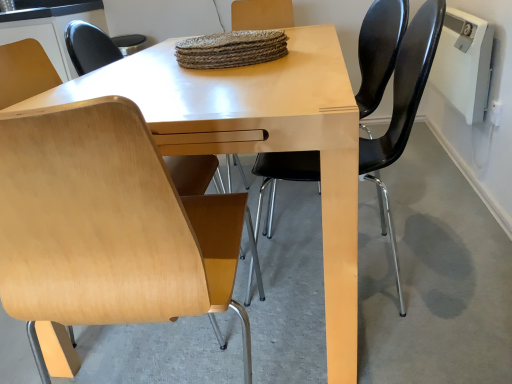
The width and height of the screenshot is (512, 384). What do you see at coordinates (108, 224) in the screenshot?
I see `beech wood chair at left, placed as the first chair when sorted from left to right` at bounding box center [108, 224].

Describe the element at coordinates (403, 107) in the screenshot. The height and width of the screenshot is (384, 512). I see `black leather chair at right, which appears as the first chair when viewed from the right` at that location.

What are the coordinates of `black leather chair at right, positioned as the second chair in left-to-right order` in the screenshot? It's located at (403, 107).

Image resolution: width=512 pixels, height=384 pixels. I want to click on beech wood chair at left, placed as the first chair when sorted from left to right, so click(x=108, y=224).

Can you confirm if beech wood chair at lower left is smaller than beech wood chair at left, placed as the first chair when sorted from left to right?

Yes.

In order to click on chair on the left side of beech wood chair at lower left in this screenshot , I will do `click(108, 224)`.

Does beech wood chair at lower left have a lesser height compared to beech wood chair at left, which is counted as the 2th chair, starting from the right?

Correct, beech wood chair at lower left is not as tall as beech wood chair at left, which is counted as the 2th chair, starting from the right.

From a real-world perspective, is beech wood chair at lower left positioned over beech wood chair at left, which is counted as the 2th chair, starting from the right, based on gravity?

Actually, beech wood chair at lower left is physically below beech wood chair at left, which is counted as the 2th chair, starting from the right, in the real world.

Considering the relative sizes of beech wood chair at lower left and black leather chair at right, which appears as the first chair when viewed from the right, in the image provided, is beech wood chair at lower left wider than black leather chair at right, which appears as the first chair when viewed from the right,?

Yes.

At what (x,y) coordinates should I click in order to perform the action: click on concrete that appears below the black leather chair at right, positioned as the second chair in left-to-right order (from a real-world perspective). Please return your answer as a coordinate pair (x, y). Looking at the image, I should click on (433, 277).

Based on their sizes in the image, would you say beech wood chair at lower left is bigger or smaller than black leather chair at right, which appears as the first chair when viewed from the right?

Considering their sizes, beech wood chair at lower left takes up less space than black leather chair at right, which appears as the first chair when viewed from the right.

Consider the image. Can you confirm if beech wood chair at lower left is shorter than black leather chair at right, which appears as the first chair when viewed from the right?

Yes, beech wood chair at lower left is shorter than black leather chair at right, which appears as the first chair when viewed from the right.

In the scene shown: Is black leather chair at right, which appears as the first chair when viewed from the right, surrounded by beech wood chair at left, which is counted as the 2th chair, starting from the right?

That's incorrect, black leather chair at right, which appears as the first chair when viewed from the right, is not inside beech wood chair at left, which is counted as the 2th chair, starting from the right.

Is beech wood chair at left, which is counted as the 2th chair, starting from the right, to the left or to the right of black leather chair at right, positioned as the second chair in left-to-right order, in the image?

Based on their positions, beech wood chair at left, which is counted as the 2th chair, starting from the right, is located to the left of black leather chair at right, positioned as the second chair in left-to-right order.

Could you tell me if beech wood chair at left, which is counted as the 2th chair, starting from the right, is turned towards black leather chair at right, positioned as the second chair in left-to-right order?

No, beech wood chair at left, which is counted as the 2th chair, starting from the right, is not facing towards black leather chair at right, positioned as the second chair in left-to-right order.

Is beech wood chair at left, placed as the first chair when sorted from left to right, positioned in front of black leather chair at right, which appears as the first chair when viewed from the right?

Yes, beech wood chair at left, placed as the first chair when sorted from left to right, is in front of black leather chair at right, which appears as the first chair when viewed from the right.

Which is nearer, (22, 131) or (13, 361)?

The point (22, 131) is in front.

Which is more to the right, beech wood chair at left, placed as the first chair when sorted from left to right, or beech wood chair at lower left?

beech wood chair at lower left is more to the right.

From the image's perspective, which chair is the 1st one above the beech wood chair at lower left? Please provide its 2D coordinates.

[(108, 224)]

Is beech wood chair at left, which is counted as the 2th chair, starting from the right, beside beech wood chair at lower left?

They are not placed beside each other.

How different are the orientations of black leather chair at right, which appears as the first chair when viewed from the right, and beech wood chair at left, placed as the first chair when sorted from left to right, in degrees?

87.7 degrees.

Is black leather chair at right, positioned as the second chair in left-to-right order, positioned beyond the bounds of beech wood chair at left, placed as the first chair when sorted from left to right?

black leather chair at right, positioned as the second chair in left-to-right order, lies outside beech wood chair at left, placed as the first chair when sorted from left to right,'s area.

Does black leather chair at right, positioned as the second chair in left-to-right order, appear on the right side of beech wood chair at left, placed as the first chair when sorted from left to right?

Correct, you'll find black leather chair at right, positioned as the second chair in left-to-right order, to the right of beech wood chair at left, placed as the first chair when sorted from left to right.

From the image's perspective, which is below, black leather chair at right, positioned as the second chair in left-to-right order, or beech wood chair at left, placed as the first chair when sorted from left to right?

beech wood chair at left, placed as the first chair when sorted from left to right.

Consider the image. Considering the positions of objects black leather chair at right, positioned as the second chair in left-to-right order, and beech wood chair at lower left in the image provided, who is more to the left, black leather chair at right, positioned as the second chair in left-to-right order, or beech wood chair at lower left?

From the viewer's perspective, beech wood chair at lower left appears more on the left side.

Are black leather chair at right, which appears as the first chair when viewed from the right, and beech wood chair at lower left far apart?

No, black leather chair at right, which appears as the first chair when viewed from the right, is not far from beech wood chair at lower left.

What's the angular difference between black leather chair at right, which appears as the first chair when viewed from the right, and beech wood chair at lower left's facing directions?

They differ by 92.1 degrees in their facing directions.

Looking at this image, could you tell me if black leather chair at right, which appears as the first chair when viewed from the right, is turned towards beech wood chair at lower left?

Yes.

Identify the location of concrete that appears behind the beech wood chair at left, placed as the first chair when sorted from left to right. (433, 277).

The width and height of the screenshot is (512, 384). Find the location of `concrete below the black leather chair at right, which appears as the first chair when viewed from the right (from a real-world perspective)`. concrete below the black leather chair at right, which appears as the first chair when viewed from the right (from a real-world perspective) is located at coordinates (433, 277).

Based on their spatial positions, is beech wood chair at lower left or black leather chair at right, positioned as the second chair in left-to-right order, closer to beech wood chair at left, which is counted as the 2th chair, starting from the right?

black leather chair at right, positioned as the second chair in left-to-right order, lies closer to beech wood chair at left, which is counted as the 2th chair, starting from the right, than the other object.

Looking at the image, which one is located further to black leather chair at right, which appears as the first chair when viewed from the right, beech wood chair at left, which is counted as the 2th chair, starting from the right, or beech wood chair at lower left?

Among the two, beech wood chair at left, which is counted as the 2th chair, starting from the right, is located further to black leather chair at right, which appears as the first chair when viewed from the right.

When comparing their distances from beech wood chair at lower left, does beech wood chair at left, placed as the first chair when sorted from left to right, or black leather chair at right, positioned as the second chair in left-to-right order, seem closer?

Based on the image, black leather chair at right, positioned as the second chair in left-to-right order, appears to be nearer to beech wood chair at lower left.

Consider the image. Looking at the image, which one is located closer to beech wood chair at lower left, black leather chair at right, positioned as the second chair in left-to-right order, or beech wood chair at left, which is counted as the 2th chair, starting from the right?

Based on the image, black leather chair at right, positioned as the second chair in left-to-right order, appears to be nearer to beech wood chair at lower left.

Estimate the real-world distances between objects in this image. Which object is closer to black leather chair at right, which appears as the first chair when viewed from the right, beech wood chair at lower left or beech wood chair at left, placed as the first chair when sorted from left to right?

The object closer to black leather chair at right, which appears as the first chair when viewed from the right, is beech wood chair at lower left.

Estimate the real-world distances between objects in this image. Which object is closer to beech wood chair at left, placed as the first chair when sorted from left to right, black leather chair at right, positioned as the second chair in left-to-right order, or beech wood chair at lower left?

black leather chair at right, positioned as the second chair in left-to-right order, is closer to beech wood chair at left, placed as the first chair when sorted from left to right.

Where is `chair positioned between beech wood chair at left, which is counted as the 2th chair, starting from the right, and beech wood chair at lower left from near to far`? Image resolution: width=512 pixels, height=384 pixels. chair positioned between beech wood chair at left, which is counted as the 2th chair, starting from the right, and beech wood chair at lower left from near to far is located at coordinates (403, 107).